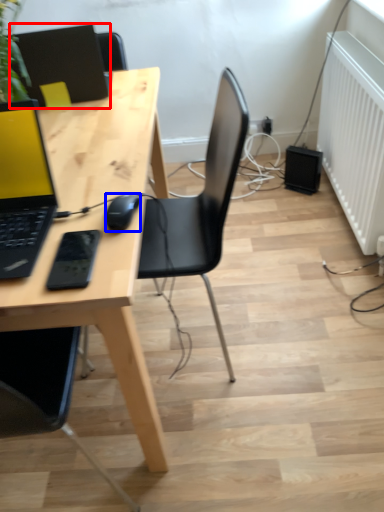
Question: Which point is closer to the camera, laptop (highlighted by a red box) or mouse (highlighted by a blue box)?

Choices:
 (A) laptop
 (B) mouse

Answer: (B)